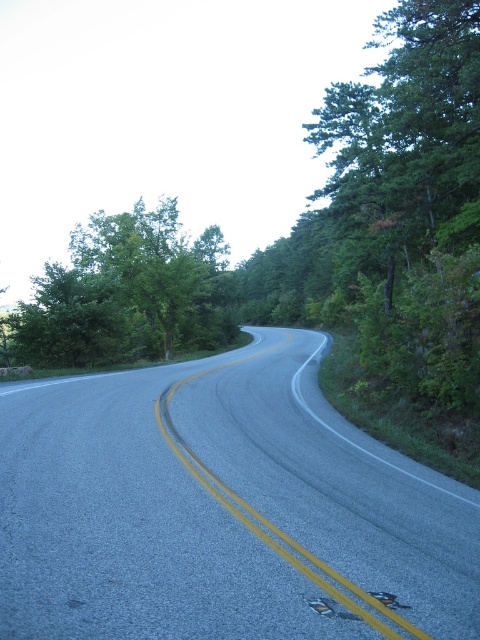
Question: Is gray asphalt road at center to the right of green leafy tree at left from the viewer's perspective?

Choices:
 (A) no
 (B) yes

Answer: (B)

Question: Which object appears farthest from the camera in this image?

Choices:
 (A) green leafy tree at left
 (B) gray asphalt road at center

Answer: (A)

Question: Which point is farther to the camera?

Choices:
 (A) (60, 586)
 (B) (90, 353)

Answer: (B)

Question: Can you confirm if gray asphalt road at center is positioned to the right of green leafy tree at left?

Choices:
 (A) no
 (B) yes

Answer: (B)

Question: Is gray asphalt road at center to the left of green leafy tree at left from the viewer's perspective?

Choices:
 (A) yes
 (B) no

Answer: (B)